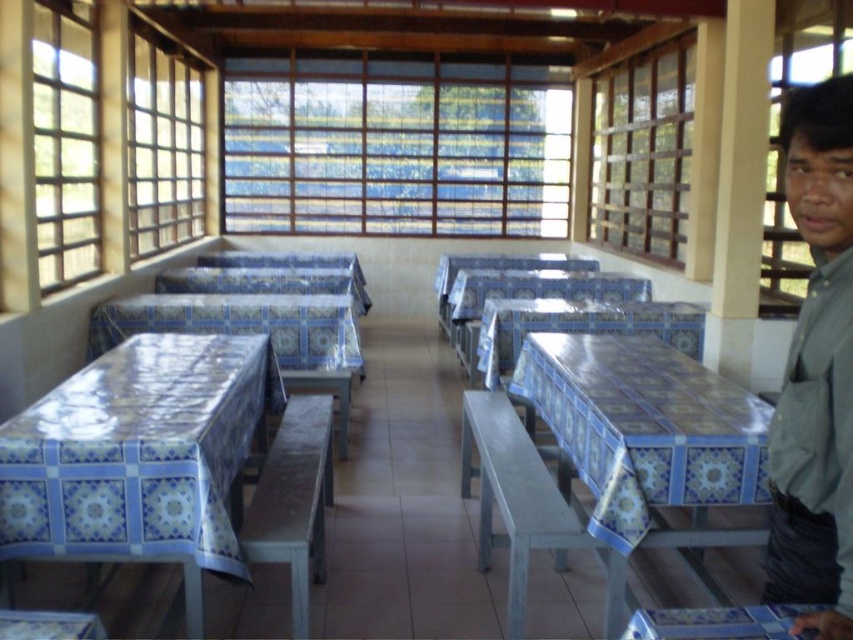
Between blue tile table at right and blue tile table at lower center, which one appears on the right side from the viewer's perspective?

blue tile table at right is more to the right.

Does blue tile table at right lie in front of blue tile table at lower center?

No.

Between point (699, 470) and point (775, 625), which one is positioned in front?

Point (775, 625)

You are a GUI agent. You are given a task and a screenshot of the screen. Output one action in this format:
    pyautogui.click(x=<x>, y=<y>)
    Task: Click on the blue tile table at right
    
    Given the screenshot: What is the action you would take?
    pyautogui.click(x=643, y=433)

Between green matte shirt at right and wooden slats at upper right, which one has more height?

With more height is wooden slats at upper right.

Does green matte shirt at right have a greater width compared to wooden slats at upper right?

No, green matte shirt at right is not wider than wooden slats at upper right.

Locate an element on the screen. green matte shirt at right is located at coordinates (816, 371).

Does green matte shirt at right appear over clear glass window at upper left?

Actually, green matte shirt at right is below clear glass window at upper left.

Is green matte shirt at right wider than clear glass window at upper left?

No.

Does point (813, 419) come behind point (83, 257)?

No, (813, 419) is in front of (83, 257).

The image size is (853, 640). I want to click on green matte shirt at right, so click(x=816, y=371).